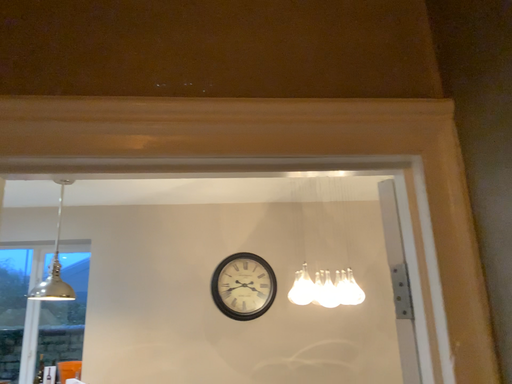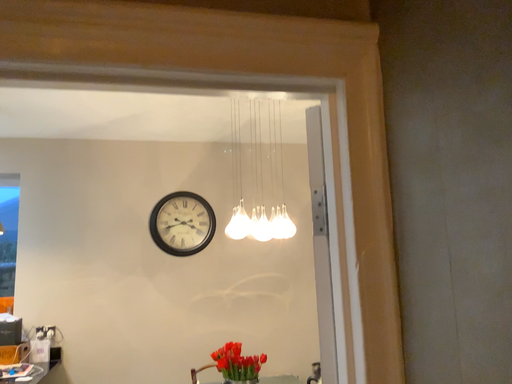
Question: How did the camera likely rotate when shooting the video?

Choices:
 (A) rotated upward
 (B) rotated downward

Answer: (B)